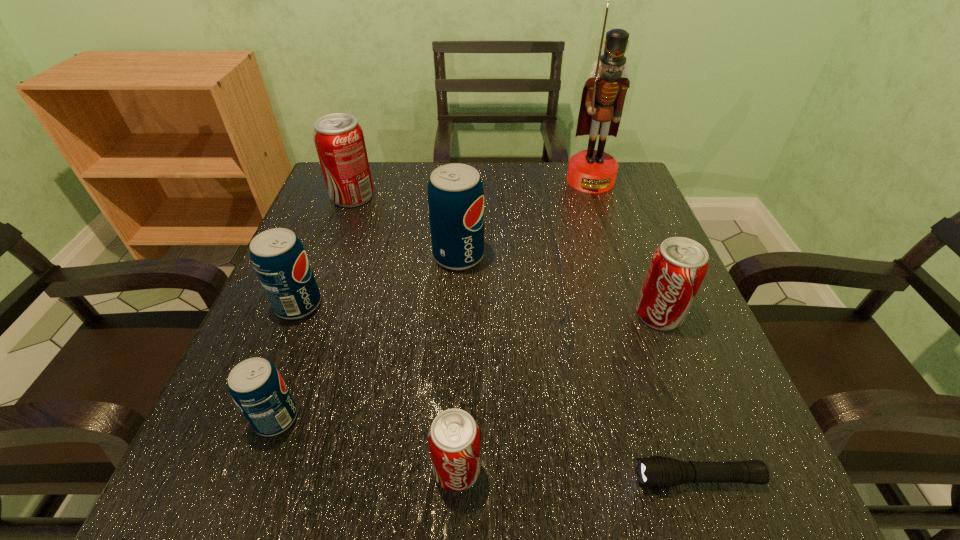
Image resolution: width=960 pixels, height=540 pixels. Identify the location of flashlight that is at the right edge. (656, 471).

At what (x,y) coordinates should I click in order to perform the action: click on object at the far left corner. Please return your answer as a coordinate pair (x, y). The height and width of the screenshot is (540, 960). Looking at the image, I should click on (339, 140).

In order to click on object positioned at the far right corner in this screenshot , I will do `click(593, 171)`.

Where is `object that is at the near right corner`? The height and width of the screenshot is (540, 960). object that is at the near right corner is located at coordinates (656, 471).

In the image, there is a desktop. Identify the location of vacant space at the far edge. (495, 207).

Locate an element on the screen. vacant space at the left edge of the desktop is located at coordinates (264, 349).

What are the coordinates of `free space at the right edge of the desktop` in the screenshot? It's located at (624, 252).

This screenshot has height=540, width=960. Identify the location of vacant space at the far left corner of the desktop. (371, 213).

Identify the location of free space at the far right corner. (629, 206).

I want to click on free point at the near right corner, so click(725, 461).